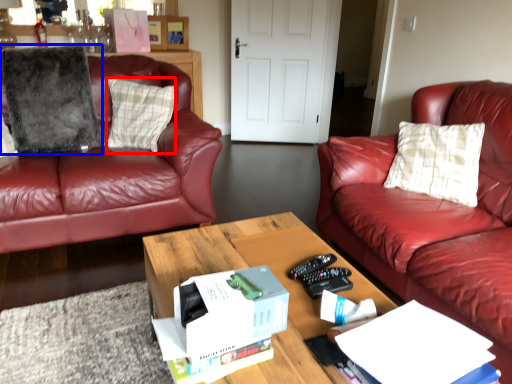
Question: Which of the following is the farthest to the observer, pillow (highlighted by a red box) or pillow (highlighted by a blue box)?

Choices:
 (A) pillow
 (B) pillow

Answer: (A)